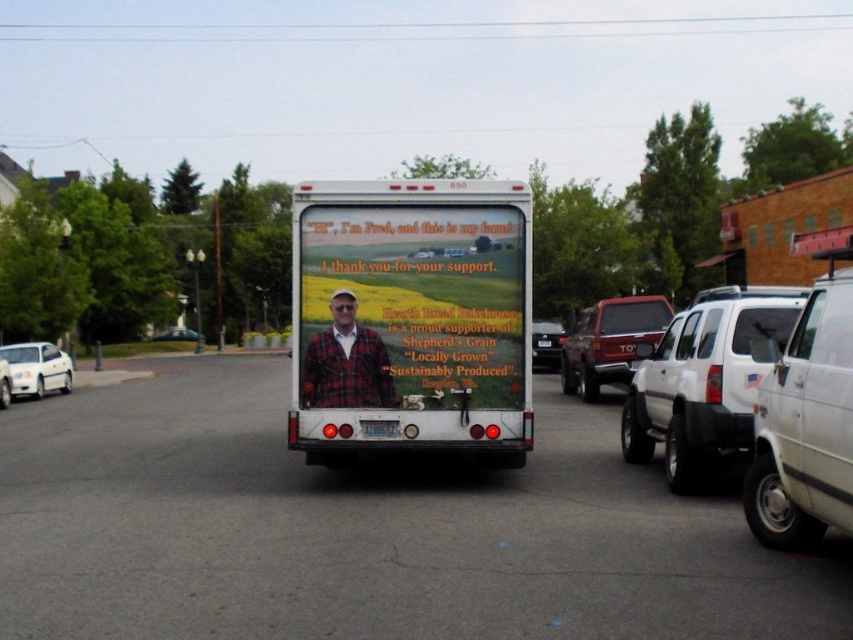
Question: Does metallic red truck at center come behind white plastic license plate at center?

Choices:
 (A) no
 (B) yes

Answer: (B)

Question: Which object is farther from the camera taking this photo?

Choices:
 (A) white glossy sedan at left
 (B) matte white truck at center
 (C) white matte suv at right

Answer: (A)

Question: Does matte white truck at center have a lesser width compared to white plastic license plate at rear?

Choices:
 (A) yes
 (B) no

Answer: (B)

Question: Is plaid fabric man at center in front of white plastic license plate at rear?

Choices:
 (A) yes
 (B) no

Answer: (A)

Question: Among these objects, which one is nearest to the camera?

Choices:
 (A) white plastic license plate at rear
 (B) plaid fabric man at center
 (C) white matte van at right
 (D) white plastic license plate at center

Answer: (C)

Question: Considering the real-world distances, which object is farthest from the metallic red truck at center?

Choices:
 (A) white plastic license plate at center
 (B) white glossy sedan at left
 (C) white matte sedan at left

Answer: (B)